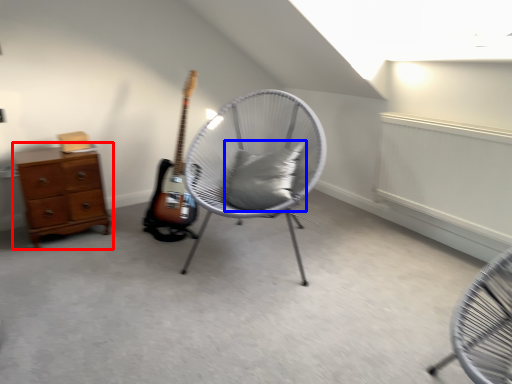
Question: Which point is further to the camera, chest of drawers (highlighted by a red box) or pillow (highlighted by a blue box)?

Choices:
 (A) chest of drawers
 (B) pillow

Answer: (A)